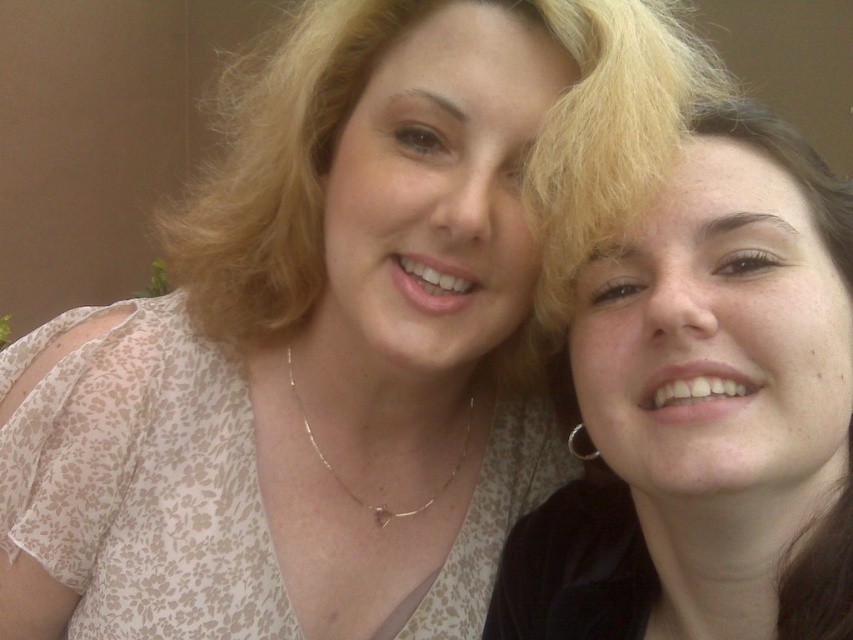
Question: Is blondehair at center below silver metallic earring at right?

Choices:
 (A) no
 (B) yes

Answer: (A)

Question: Which point appears closest to the camera in this image?

Choices:
 (A) (572, 429)
 (B) (589, 577)
 (C) (548, 237)

Answer: (C)

Question: Can you confirm if blondehair at center is positioned below silver metallic earring at right?

Choices:
 (A) no
 (B) yes

Answer: (A)

Question: Does blondehair at center appear under silver metallic earring at right?

Choices:
 (A) yes
 (B) no

Answer: (B)

Question: Among these points, which one is nearest to the camera?

Choices:
 (A) (624, 614)
 (B) (576, 60)

Answer: (B)

Question: Which is nearer to the matte white blouse at right?

Choices:
 (A) silver metallic earring at right
 (B) blondehair at center

Answer: (B)